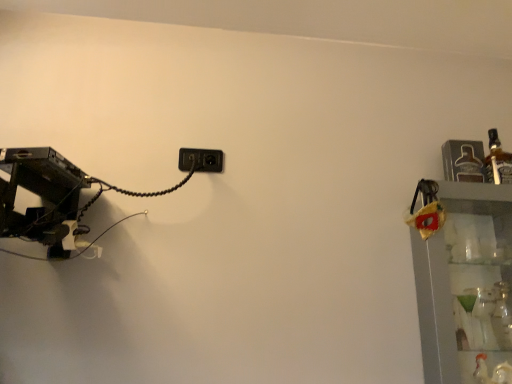
This screenshot has width=512, height=384. In order to click on clear glass shelves at right in this screenshot , I will do tap(465, 284).

What are the coordinates of `translucent glass bottle at upper right` in the screenshot? It's located at (497, 161).

Can you tell me how much black plastic power plugs and sockets at center and clear glass shelves at right differ in facing direction?

black plastic power plugs and sockets at center and clear glass shelves at right are facing 1.67 degrees away from each other.

From a real-world perspective, which is physically below, black plastic power plugs and sockets at center or clear glass shelves at right?

clear glass shelves at right is physically lower.

Between black plastic power plugs and sockets at center and clear glass shelves at right, which one appears on the right side from the viewer's perspective?

Positioned to the right is clear glass shelves at right.

Does black plastic power plugs and sockets at center have a lesser width compared to clear glass shelves at right?

Yes, black plastic power plugs and sockets at center is thinner than clear glass shelves at right.

Does translucent glass bottle at upper right lie in front of clear glass shelves at right?

No, it is behind clear glass shelves at right.

What's the angular difference between translucent glass bottle at upper right and clear glass shelves at right's facing directions?

The facing directions of translucent glass bottle at upper right and clear glass shelves at right are 2.63 degrees apart.

Is translucent glass bottle at upper right aimed at clear glass shelves at right?

No, translucent glass bottle at upper right is not turned towards clear glass shelves at right.

Considering the relative sizes of translucent glass bottle at upper right and clear glass shelves at right in the image provided, is translucent glass bottle at upper right shorter than clear glass shelves at right?

Yes.

How distant is clear glass shelves at right from translucent glass bottle at upper right?

A distance of 13.71 inches exists between clear glass shelves at right and translucent glass bottle at upper right.

From a real-world perspective, between clear glass shelves at right and translucent glass bottle at upper right, who is vertically higher?

translucent glass bottle at upper right, from a real-world perspective.

Is clear glass shelves at right looking in the opposite direction of translucent glass bottle at upper right?

No, translucent glass bottle at upper right is not at the back of clear glass shelves at right.

Is clear glass shelves at right far from translucent glass bottle at upper right?

No.

Is translucent glass bottle at upper right bigger or smaller than black plastic power plugs and sockets at center?

translucent glass bottle at upper right is bigger than black plastic power plugs and sockets at center.

Identify the location of power plugs and sockets to the left of translucent glass bottle at upper right. (201, 160).

Considering the sizes of objects translucent glass bottle at upper right and black plastic power plugs and sockets at center in the image provided, who is thinner, translucent glass bottle at upper right or black plastic power plugs and sockets at center?

Thinner between the two is black plastic power plugs and sockets at center.

From a real-world perspective, relative to black plastic power plugs and sockets at center, is translucent glass bottle at upper right vertically above or below?

From a real-world perspective, translucent glass bottle at upper right is physically above black plastic power plugs and sockets at center.

Is black plastic power plugs and sockets at center beside translucent glass bottle at upper right?

No, black plastic power plugs and sockets at center is not next to translucent glass bottle at upper right.

Is black plastic power plugs and sockets at center located outside translucent glass bottle at upper right?

Absolutely, black plastic power plugs and sockets at center is external to translucent glass bottle at upper right.

Who is bigger, black plastic power plugs and sockets at center or translucent glass bottle at upper right?

Bigger between the two is translucent glass bottle at upper right.

Which of these two, clear glass shelves at right or black plastic power plugs and sockets at center, is bigger?

clear glass shelves at right is bigger.

From the image's perspective, is clear glass shelves at right positioned above or below black plastic power plugs and sockets at center?

clear glass shelves at right is below black plastic power plugs and sockets at center.

How different are the orientations of clear glass shelves at right and black plastic power plugs and sockets at center in degrees?

There is a 1.67-degree angle between the facing directions of clear glass shelves at right and black plastic power plugs and sockets at center.

From a real-world perspective, is clear glass shelves at right positioned above or below black plastic power plugs and sockets at center?

From a real-world perspective, clear glass shelves at right is physically below black plastic power plugs and sockets at center.

Identify the location of shelf below the black plastic power plugs and sockets at center (from a real-world perspective). (465, 284).

Where is `shelf in front of the translucent glass bottle at upper right`? This screenshot has height=384, width=512. shelf in front of the translucent glass bottle at upper right is located at coordinates coord(465,284).

Considering their positions, is translucent glass bottle at upper right positioned further to black plastic power plugs and sockets at center than clear glass shelves at right?

Among the two, translucent glass bottle at upper right is located further to black plastic power plugs and sockets at center.

Looking at the image, which one is located further to translucent glass bottle at upper right, black plastic power plugs and sockets at center or clear glass shelves at right?

Among the two, black plastic power plugs and sockets at center is located further to translucent glass bottle at upper right.

From the image, which object appears to be farther from translucent glass bottle at upper right, clear glass shelves at right or black plastic power plugs and sockets at center?

Based on the image, black plastic power plugs and sockets at center appears to be further to translucent glass bottle at upper right.

Estimate the real-world distances between objects in this image. Which object is closer to clear glass shelves at right, translucent glass bottle at upper right or black plastic power plugs and sockets at center?

The object closer to clear glass shelves at right is translucent glass bottle at upper right.

Looking at the image, which one is located closer to clear glass shelves at right, black plastic power plugs and sockets at center or translucent glass bottle at upper right?

translucent glass bottle at upper right.

Considering their positions, is clear glass shelves at right positioned closer to black plastic power plugs and sockets at center than translucent glass bottle at upper right?

clear glass shelves at right is positioned closer to the anchor black plastic power plugs and sockets at center.

At what (x,y) coordinates should I click in order to perform the action: click on shelf between black plastic power plugs and sockets at center and translucent glass bottle at upper right from left to right. Please return your answer as a coordinate pair (x, y). The width and height of the screenshot is (512, 384). Looking at the image, I should click on (465, 284).